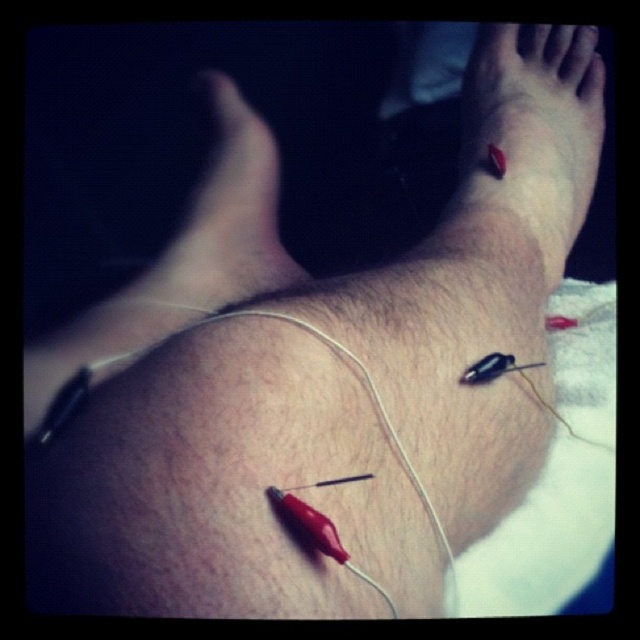
Question: Which point is closer to the camera?

Choices:
 (A) matte skin foot at center
 (B) red rubber band at upper right

Answer: (B)

Question: Does red rubber band at upper right have a larger size compared to matte skin foot at center?

Choices:
 (A) yes
 (B) no

Answer: (A)

Question: Among these objects, which one is farthest from the camera?

Choices:
 (A) matte skin foot at center
 (B) red rubber band at upper right

Answer: (A)

Question: Can you confirm if red rubber band at upper right is thinner than matte skin foot at center?

Choices:
 (A) no
 (B) yes

Answer: (A)

Question: Does red rubber band at upper right have a larger size compared to matte skin foot at center?

Choices:
 (A) yes
 (B) no

Answer: (A)

Question: Which point appears closest to the camera in this image?

Choices:
 (A) (561, 227)
 (B) (244, 264)

Answer: (A)